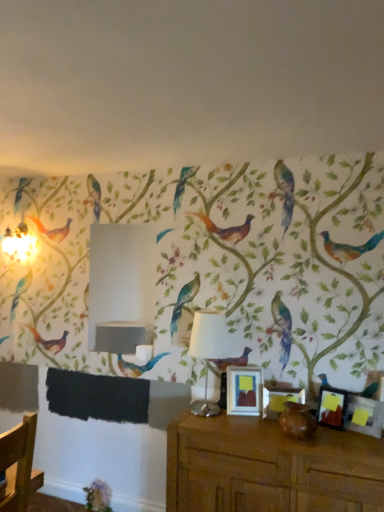
You are a GUI agent. You are given a task and a screenshot of the screen. Output one action in this format:
    pyautogui.click(x=<x>, y=<y>)
    Task: Click on the vacant space in front of brown matte vase at lower center
    
    Given the screenshot: What is the action you would take?
    pyautogui.click(x=311, y=446)